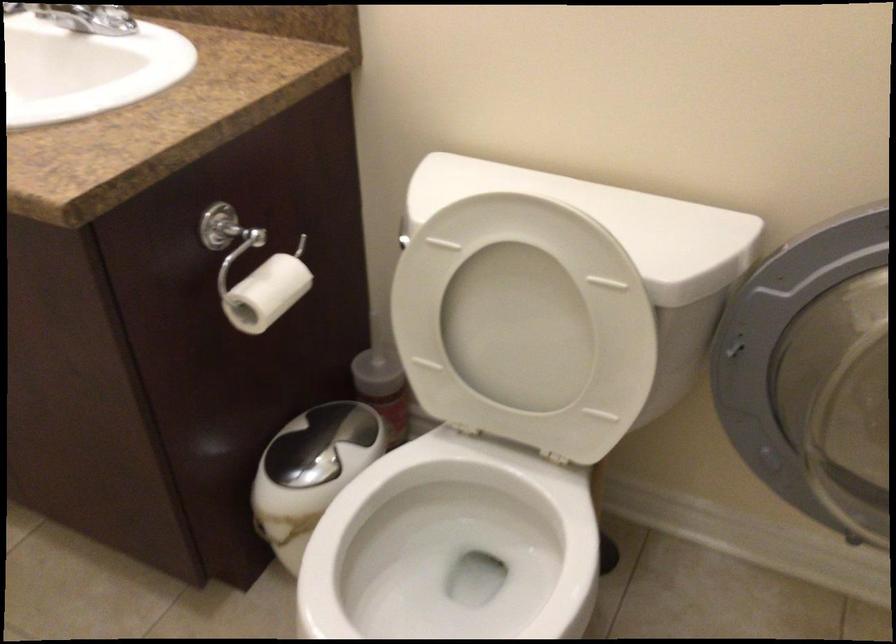
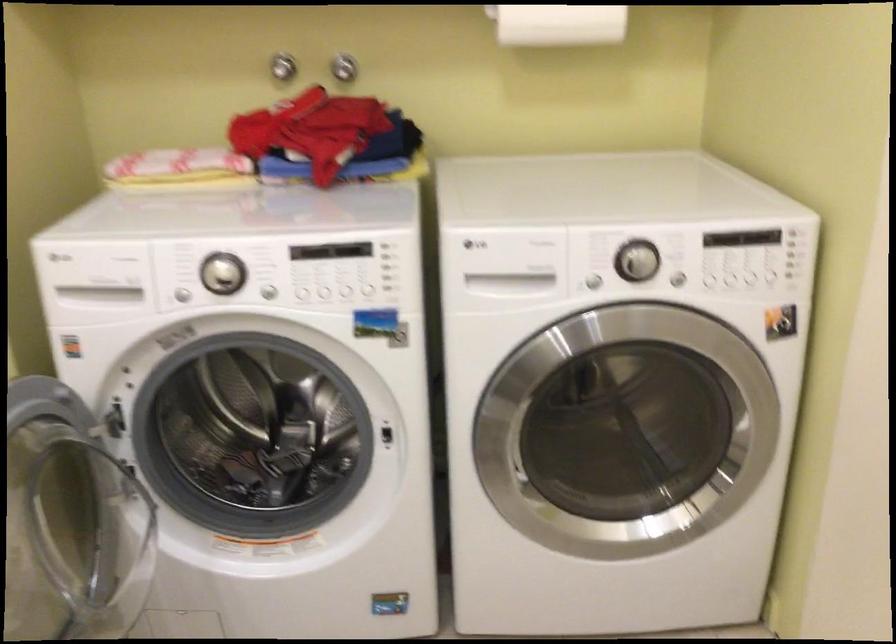
Looking at this image, based on the continuous images, in which direction is the camera rotating?

The camera's rotation is toward right-down.